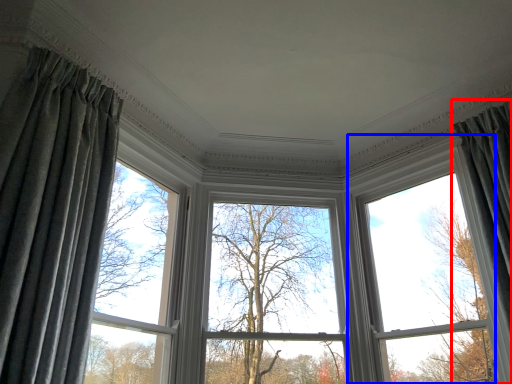
Question: Which point is further to the camera, curtain (highlighted by a red box) or bay window (highlighted by a blue box)?

Choices:
 (A) curtain
 (B) bay window

Answer: (B)